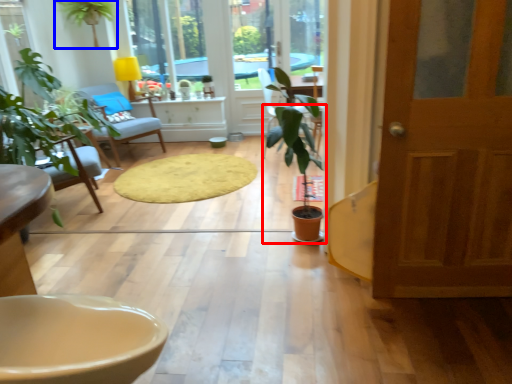
Question: Among these objects, which one is farthest to the camera, houseplant (highlighted by a red box) or houseplant (highlighted by a blue box)?

Choices:
 (A) houseplant
 (B) houseplant

Answer: (B)